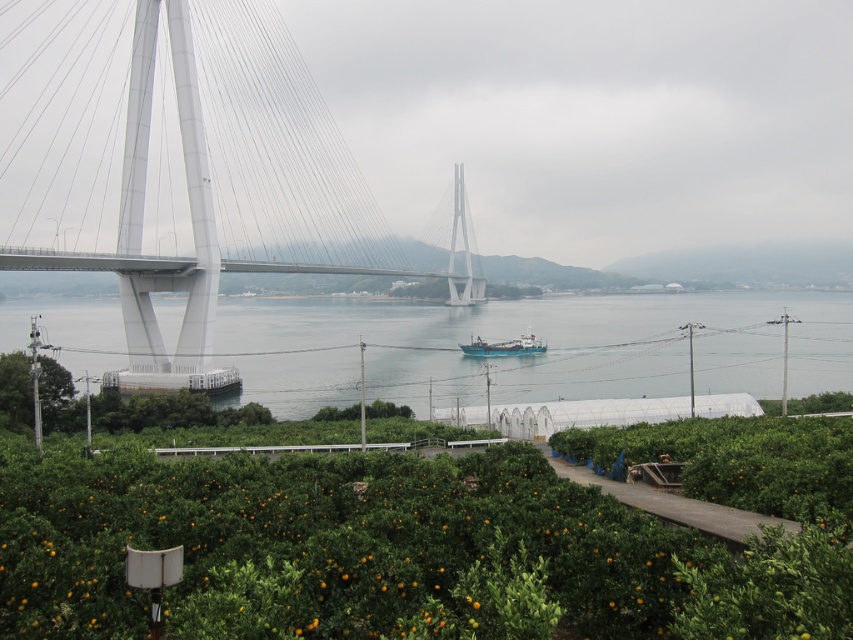
Is clear water at center below blue matte boat at center?

No.

Is clear water at center thinner than blue matte boat at center?

In fact, clear water at center might be wider than blue matte boat at center.

The height and width of the screenshot is (640, 853). What do you see at coordinates (531, 355) in the screenshot? I see `clear water at center` at bounding box center [531, 355].

Locate an element on the screen. The height and width of the screenshot is (640, 853). clear water at center is located at coordinates (531, 355).

Is the position of white metallic suspension bridge at left less distant than that of blue matte boat at center?

Yes.

Which is below, white metallic suspension bridge at left or blue matte boat at center?

blue matte boat at center

Does point (111, 124) come in front of point (518, 342)?

That is True.

This screenshot has width=853, height=640. In order to click on white metallic suspension bridge at left in this screenshot , I will do `click(183, 164)`.

Is point (155, 372) farther from viewer compared to point (527, 305)?

No.

Is white metallic suspension bridge at left taller than clear water at center?

Yes, white metallic suspension bridge at left is taller than clear water at center.

The height and width of the screenshot is (640, 853). I want to click on white metallic suspension bridge at left, so click(x=183, y=164).